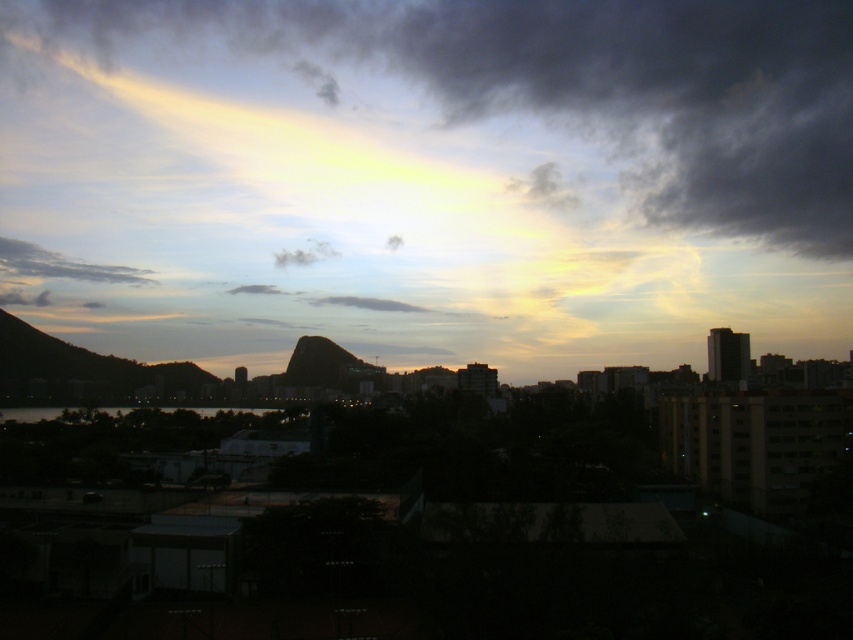
Question: Does cloudy sky at upper center have a lesser width compared to white fluffy cloud at center?

Choices:
 (A) no
 (B) yes

Answer: (A)

Question: Is cloudy sky at upper center further to the viewer compared to gray cotton cloud at upper left?

Choices:
 (A) yes
 (B) no

Answer: (A)

Question: Which point appears closest to the camera in this image?

Choices:
 (A) pos(49,272)
 (B) pos(404,80)

Answer: (A)

Question: From the image, what is the correct spatial relationship of transparent water at lower center in relation to translucent white cloud at center?

Choices:
 (A) left
 (B) right

Answer: (A)

Question: Which object is positioned closest to the translucent white cloud at center?

Choices:
 (A) white fluffy cloud at center
 (B) cloudy sky at upper center
 (C) gray cotton cloud at upper left
 (D) gray matte cloud at center

Answer: (A)

Question: Which point appears closest to the camera in this image?

Choices:
 (A) (426, 310)
 (B) (267, 285)
 (C) (41, 24)

Answer: (A)